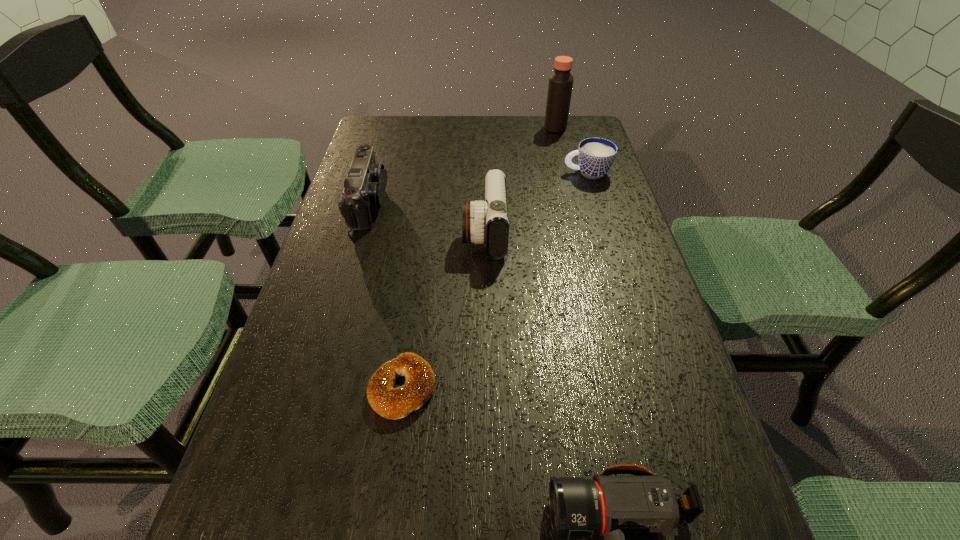
Identify the location of vacant space located on the surface of the second camcorder from right to left. The width and height of the screenshot is (960, 540). (440, 232).

What are the coordinates of `free space located on the front-facing side of the leftmost camcorder` in the screenshot? It's located at (528, 204).

The image size is (960, 540). Find the location of `vacant space positioned on the side of the cup with the handle`. vacant space positioned on the side of the cup with the handle is located at coordinates (436, 173).

Locate an element on the screen. The height and width of the screenshot is (540, 960). blank area located on the side of the cup with the handle is located at coordinates (443, 173).

The height and width of the screenshot is (540, 960). I want to click on blank space located 0.090m on the side of the cup with the handle, so click(532, 173).

The height and width of the screenshot is (540, 960). I want to click on vacant space located 0.150m on the front of the shortest object, so click(x=384, y=519).

The image size is (960, 540). Find the location of `object situated at the far edge`. object situated at the far edge is located at coordinates (560, 86).

You are a GUI agent. You are given a task and a screenshot of the screen. Output one action in this format:
    pyautogui.click(x=<x>, y=<y>)
    Task: Click on the object located in the left edge section of the desktop
    The image size is (960, 540).
    Given the screenshot: What is the action you would take?
    pyautogui.click(x=364, y=187)

You are a GUI agent. You are given a task and a screenshot of the screen. Output one action in this format:
    pyautogui.click(x=<x>, y=<y>)
    Task: Click on the vinegar located at the right edge
    This screenshot has width=960, height=540.
    Given the screenshot: What is the action you would take?
    pyautogui.click(x=560, y=86)

Where is `cup that is at the right edge`? cup that is at the right edge is located at coordinates (595, 155).